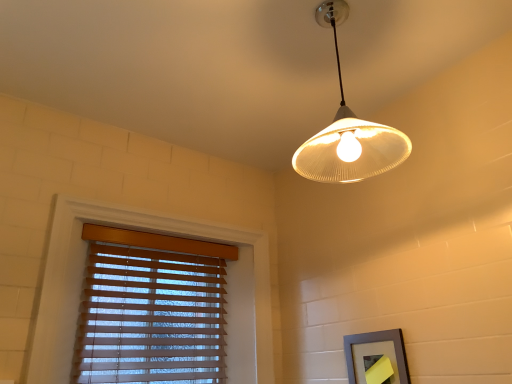
Image resolution: width=512 pixels, height=384 pixels. Identify the location of wooden blinds at lower left. (151, 309).

What do you see at coordinates (348, 131) in the screenshot? I see `white ribbed glass lampshade at upper center` at bounding box center [348, 131].

You are a GUI agent. You are given a task and a screenshot of the screen. Output one action in this format:
    pyautogui.click(x=<x>, y=<y>)
    Task: Click on the wooden blinds at lower left
    The height and width of the screenshot is (384, 512).
    Given the screenshot: What is the action you would take?
    pyautogui.click(x=151, y=309)

Is white ribbed glass lampshade at upper center not within wooden blinds at lower left?

white ribbed glass lampshade at upper center is positioned outside wooden blinds at lower left.

Is the position of white ribbed glass lampshade at upper center more distant than that of wooden blinds at lower left?

That is False.

From the image's perspective, is white ribbed glass lampshade at upper center located above or below wooden blinds at lower left?

From the image's perspective, white ribbed glass lampshade at upper center appears above wooden blinds at lower left.

Considering the relative sizes of white ribbed glass lampshade at upper center and wooden blinds at lower left in the image provided, is white ribbed glass lampshade at upper center smaller than wooden blinds at lower left?

Yes, white ribbed glass lampshade at upper center is smaller than wooden blinds at lower left.

Is gray matte picture frame at lower right looking in the opposite direction of wooden blinds at lower left?

gray matte picture frame at lower right is not turned away from wooden blinds at lower left.

From a real-world perspective, which object stands above the other?

wooden blinds at lower left is physically above.

Considering the points (354, 336) and (170, 250), which point is behind, point (354, 336) or point (170, 250)?

Point (170, 250)

Image resolution: width=512 pixels, height=384 pixels. In order to click on window blind that appears above the gray matte picture frame at lower right (from the image's perspective) in this screenshot , I will do `click(151, 309)`.

Is white ribbed glass lampshade at upper center smaller than gray matte picture frame at lower right?

No.

Considering the relative positions of white ribbed glass lampshade at upper center and gray matte picture frame at lower right in the image provided, is white ribbed glass lampshade at upper center behind gray matte picture frame at lower right?

That is False.

Does white ribbed glass lampshade at upper center turn towards gray matte picture frame at lower right?

No, white ribbed glass lampshade at upper center does not turn towards gray matte picture frame at lower right.

Is white ribbed glass lampshade at upper center taller than gray matte picture frame at lower right?

Yes, white ribbed glass lampshade at upper center is taller than gray matte picture frame at lower right.

Is gray matte picture frame at lower right oriented towards white ribbed glass lampshade at upper center?

No, gray matte picture frame at lower right is not aimed at white ribbed glass lampshade at upper center.

From a real-world perspective, which object rests below the other?

In real-world perspective, gray matte picture frame at lower right is lower.

Is gray matte picture frame at lower right bigger than white ribbed glass lampshade at upper center?

Actually, gray matte picture frame at lower right might be smaller than white ribbed glass lampshade at upper center.

Where is `picture frame located behind the white ribbed glass lampshade at upper center`? Image resolution: width=512 pixels, height=384 pixels. picture frame located behind the white ribbed glass lampshade at upper center is located at coordinates (376, 357).

Does wooden blinds at lower left have a greater height compared to white ribbed glass lampshade at upper center?

Yes, wooden blinds at lower left is taller than white ribbed glass lampshade at upper center.

How many degrees apart are the facing directions of wooden blinds at lower left and white ribbed glass lampshade at upper center?

The facing directions of wooden blinds at lower left and white ribbed glass lampshade at upper center are 89.5 degrees apart.

Does point (126, 302) appear closer or farther from the camera than point (345, 132)?

Clearly, point (126, 302) is more distant from the camera than point (345, 132).

Between wooden blinds at lower left and white ribbed glass lampshade at upper center, which one appears on the left side from the viewer's perspective?

From the viewer's perspective, wooden blinds at lower left appears more on the left side.

Is wooden blinds at lower left turned away from gray matte picture frame at lower right?

A: No, wooden blinds at lower left's orientation is not away from gray matte picture frame at lower right.

Is gray matte picture frame at lower right a part of wooden blinds at lower left?

No, wooden blinds at lower left does not contain gray matte picture frame at lower right.

Does point (203, 271) come closer to viewer compared to point (378, 346)?

No.

What's the angular difference between wooden blinds at lower left and gray matte picture frame at lower right's facing directions?

wooden blinds at lower left and gray matte picture frame at lower right are facing 89.7 degrees away from each other.

Identify the location of window blind below the white ribbed glass lampshade at upper center (from the image's perspective). This screenshot has height=384, width=512. (151, 309).

Locate an element on the screen. window blind behind the gray matte picture frame at lower right is located at coordinates (151, 309).

From the image, which object appears to be farther from wooden blinds at lower left, white ribbed glass lampshade at upper center or gray matte picture frame at lower right?

white ribbed glass lampshade at upper center is further to wooden blinds at lower left.

Which object lies nearer to the anchor point white ribbed glass lampshade at upper center, gray matte picture frame at lower right or wooden blinds at lower left?

gray matte picture frame at lower right is positioned closer to the anchor white ribbed glass lampshade at upper center.

Looking at this image, estimate the real-world distances between objects in this image. Which object is closer to gray matte picture frame at lower right, white ribbed glass lampshade at upper center or wooden blinds at lower left?

white ribbed glass lampshade at upper center lies closer to gray matte picture frame at lower right than the other object.

Based on their spatial positions, is gray matte picture frame at lower right or white ribbed glass lampshade at upper center closer to wooden blinds at lower left?

gray matte picture frame at lower right lies closer to wooden blinds at lower left than the other object.

From the image, which object appears to be nearer to white ribbed glass lampshade at upper center, wooden blinds at lower left or gray matte picture frame at lower right?

gray matte picture frame at lower right is closer to white ribbed glass lampshade at upper center.

Which object lies nearer to the anchor point gray matte picture frame at lower right, wooden blinds at lower left or white ribbed glass lampshade at upper center?

Among the two, white ribbed glass lampshade at upper center is located nearer to gray matte picture frame at lower right.

Identify the location of window blind that lies between white ribbed glass lampshade at upper center and gray matte picture frame at lower right from top to bottom. Image resolution: width=512 pixels, height=384 pixels. (151, 309).